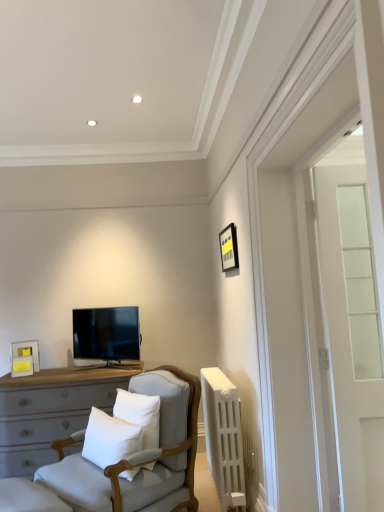
Question: Considering the relative positions of matte white picture frame at left, which ranks as the 1th picture frame in back-to-front order, and white plastic radiator at right in the image provided, is matte white picture frame at left, which ranks as the 1th picture frame in back-to-front order, behind white plastic radiator at right?

Choices:
 (A) no
 (B) yes

Answer: (B)

Question: Is white plastic radiator at right completely or partially inside matte white picture frame at left, the second picture frame in the front-to-back sequence?

Choices:
 (A) yes
 (B) no

Answer: (B)

Question: Is the surface of matte white picture frame at left, the second picture frame in the front-to-back sequence, in direct contact with white plastic radiator at right?

Choices:
 (A) no
 (B) yes

Answer: (A)

Question: Can you confirm if matte white picture frame at left, which is the first picture frame in left-to-right order, is bigger than white plastic radiator at right?

Choices:
 (A) no
 (B) yes

Answer: (A)

Question: From a real-world perspective, is matte white picture frame at left, the second picture frame in the front-to-back sequence, located beneath white plastic radiator at right?

Choices:
 (A) no
 (B) yes

Answer: (A)

Question: Based on their positions, is clear glass door at right located to the left or right of light gray fabric chair at center?

Choices:
 (A) right
 (B) left

Answer: (A)

Question: From their relative heights in the image, would you say clear glass door at right is taller or shorter than light gray fabric chair at center?

Choices:
 (A) tall
 (B) short

Answer: (A)

Question: Is clear glass door at right inside the boundaries of light gray fabric chair at center, or outside?

Choices:
 (A) outside
 (B) inside

Answer: (A)

Question: Looking at their shapes, would you say clear glass door at right is wider or thinner than light gray fabric chair at center?

Choices:
 (A) thin
 (B) wide

Answer: (A)

Question: From a real-world perspective, is light gray fabric chair at center physically located above or below matte black tv at center?

Choices:
 (A) above
 (B) below

Answer: (B)

Question: From their relative heights in the image, would you say light gray fabric chair at center is taller or shorter than matte black tv at center?

Choices:
 (A) tall
 (B) short

Answer: (A)

Question: Based on their sizes in the image, would you say light gray fabric chair at center is bigger or smaller than matte black tv at center?

Choices:
 (A) big
 (B) small

Answer: (A)

Question: Which is correct: light gray fabric chair at center is inside matte black tv at center, or outside of it?

Choices:
 (A) inside
 (B) outside

Answer: (B)

Question: In the image, is light gray fabric chair at center on the left side or the right side of clear glass door at right?

Choices:
 (A) right
 (B) left

Answer: (B)

Question: From a real-world perspective, is light gray fabric chair at center above or below clear glass door at right?

Choices:
 (A) below
 (B) above

Answer: (A)